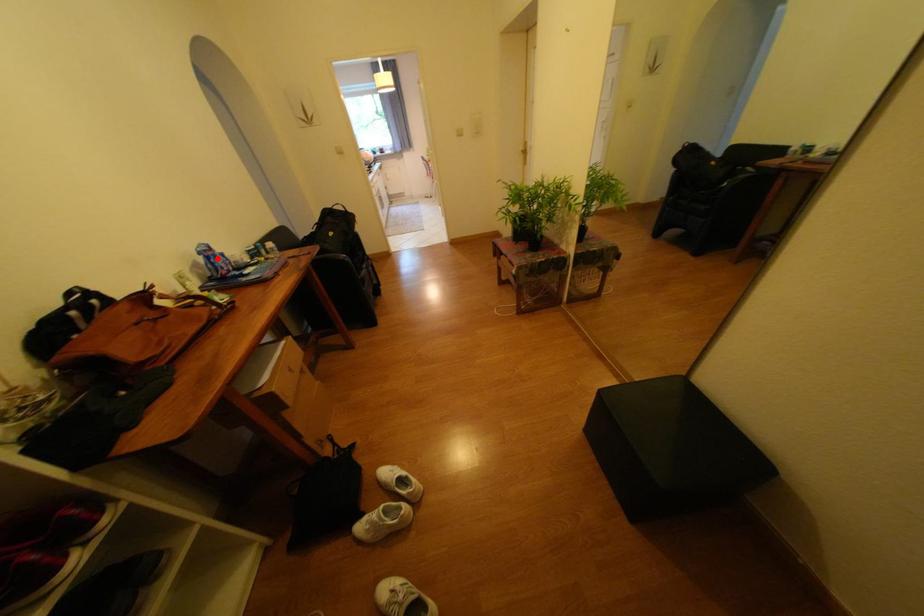
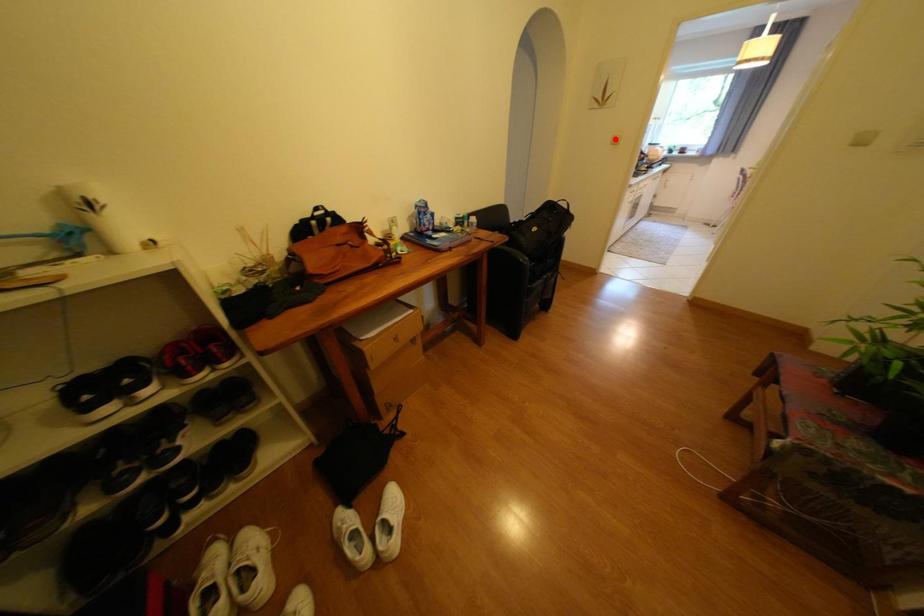
I am providing you with two images of the same scene from different viewpoints. A red point is marked on the first image and another point is marked on the second image. Do the highlighted points in image1 and image2 indicate the same real-world spot?

No